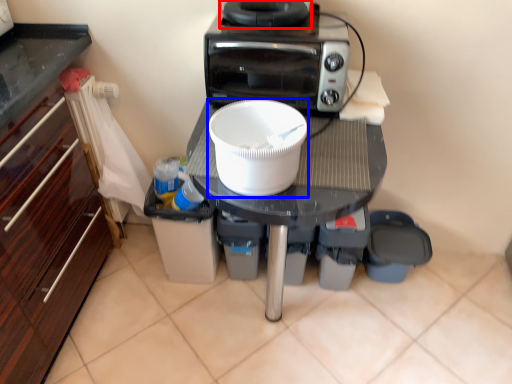
Question: Which object appears farthest to the camera in this image, appliance (highlighted by a red box) or kitchen appliance (highlighted by a blue box)?

Choices:
 (A) appliance
 (B) kitchen appliance

Answer: (A)